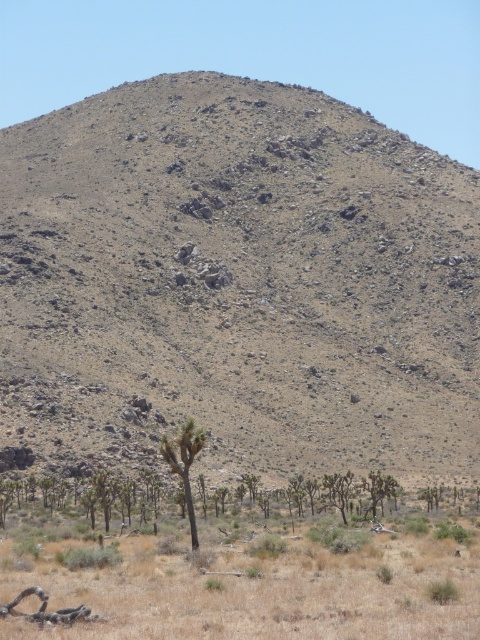
Question: In this image, where is dry grass at lower center located relative to green leafy tree at lower center?

Choices:
 (A) below
 (B) above

Answer: (B)

Question: Does dry grass at lower center appear on the left side of green leafy tree at lower center?

Choices:
 (A) yes
 (B) no

Answer: (B)

Question: Which point is farther to the camera?

Choices:
 (A) green leafy tree at lower center
 (B) dry grass at lower center
 (C) dull brown rocky hillside at center

Answer: (C)

Question: Which point is closer to the camera?

Choices:
 (A) (93, 572)
 (B) (201, 436)

Answer: (A)

Question: Observing the image, what is the correct spatial positioning of dull brown rocky hillside at center in reference to green leafy tree at lower center?

Choices:
 (A) below
 (B) above

Answer: (B)

Question: Which point is farther from the camera taking this photo?

Choices:
 (A) (180, 461)
 (B) (307, 598)
 (C) (285, 259)

Answer: (C)